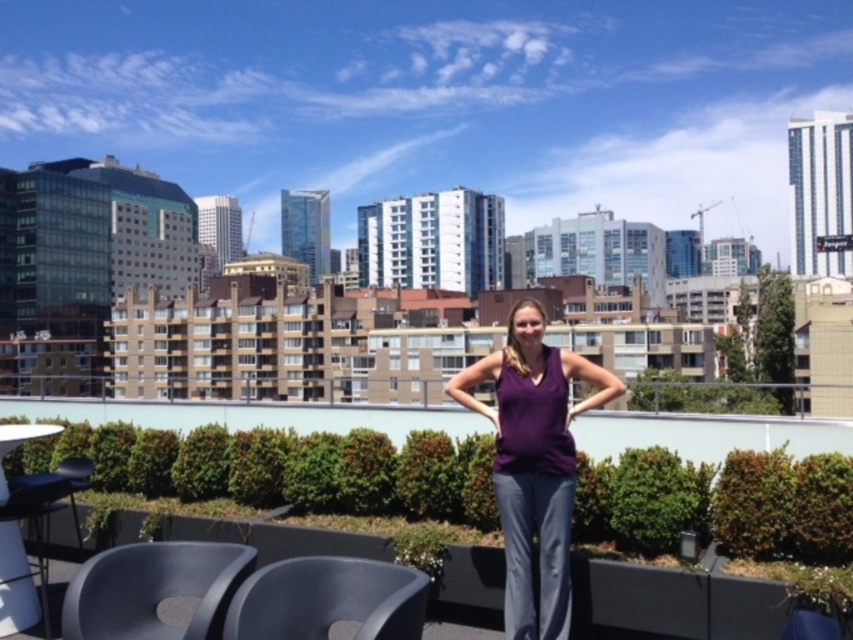
Question: Which point is closer to the camera?

Choices:
 (A) matte black chair at lower left
 (B) black plastic chair at lower center

Answer: (B)

Question: Is purple matte tank top at center thinner than matte black chair at lower left?

Choices:
 (A) no
 (B) yes

Answer: (A)

Question: Which point is closer to the camera taking this photo?

Choices:
 (A) (572, 419)
 (B) (227, 589)

Answer: (B)

Question: Does matte black chair at lower left have a smaller size compared to black plastic chair at lower center?

Choices:
 (A) yes
 (B) no

Answer: (B)

Question: Is purple matte tank top at center positioned in front of matte black chair at lower left?

Choices:
 (A) yes
 (B) no

Answer: (B)

Question: Which point is farther to the camera?

Choices:
 (A) (566, 364)
 (B) (136, 612)
 (C) (322, 611)

Answer: (A)